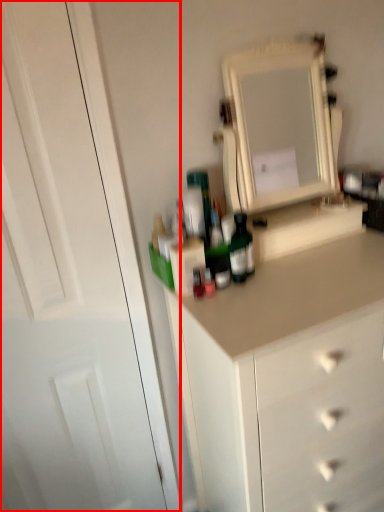
Question: From the image's perspective, where is glass door (annotated by the red box) located relative to medicine cabinet?

Choices:
 (A) below
 (B) above

Answer: (A)